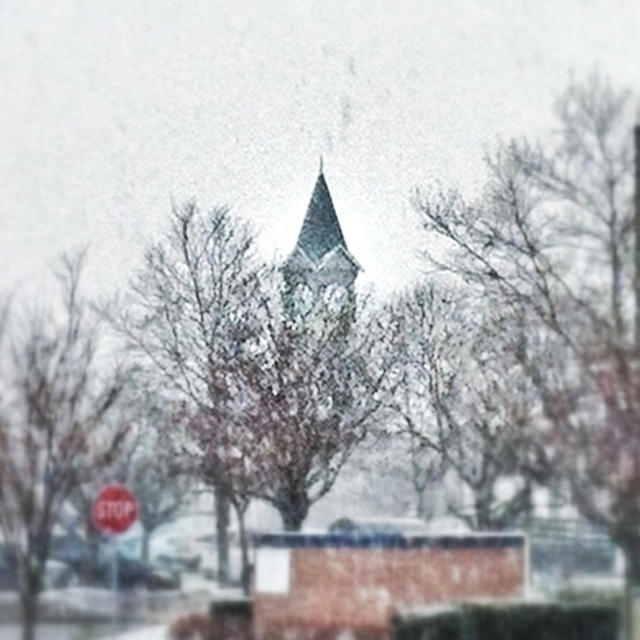
Does snow-covered branches at center have a smaller size compared to snow-covered tree at center?

No, snow-covered branches at center is not smaller than snow-covered tree at center.

Is snow-covered branches at center above snow-covered tree at center?

Correct, snow-covered branches at center is located above snow-covered tree at center.

Where is `snow-covered branches at center`? Image resolution: width=640 pixels, height=640 pixels. snow-covered branches at center is located at coordinates (557, 310).

This screenshot has height=640, width=640. In order to click on snow-covered branches at center in this screenshot , I will do `click(557, 310)`.

Does snow-covered tree at center have a lesser height compared to red matte stop sign at lower left?

Yes.

Between point (220, 237) and point (131, 512), which one is positioned in front?

Point (220, 237) is in front.

At what (x,y) coordinates should I click in order to perform the action: click on snow-covered tree at center. Please return your answer as a coordinate pair (x, y). Image resolution: width=640 pixels, height=640 pixels. Looking at the image, I should click on (252, 362).

What do you see at coordinates (557, 310) in the screenshot? This screenshot has height=640, width=640. I see `snow-covered branches at center` at bounding box center [557, 310].

In order to click on snow-covered branches at center in this screenshot , I will do `click(557, 310)`.